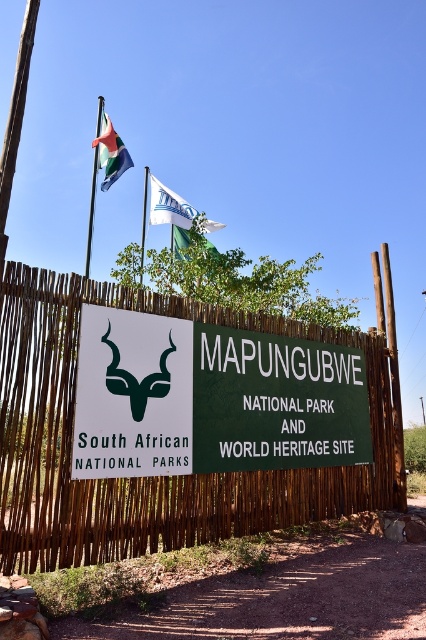
You are a park visitor standing in front of the entrance fence. You see the white fabric flag at upper center and the metallic flagpole at upper left. Which object is closer to the ground?

The white fabric flag at upper center is positioned under the metallic flagpole at upper left, meaning it is closer to the ground than the flagpole.

You are a park visitor standing at the entrance of Mapungubwe National Park. You see two flags above the fence entrance. The white fabric flag at upper center and the green fabric flag at upper center. Which flag is taller?

The white fabric flag at upper center is taller than the green fabric flag at upper center.